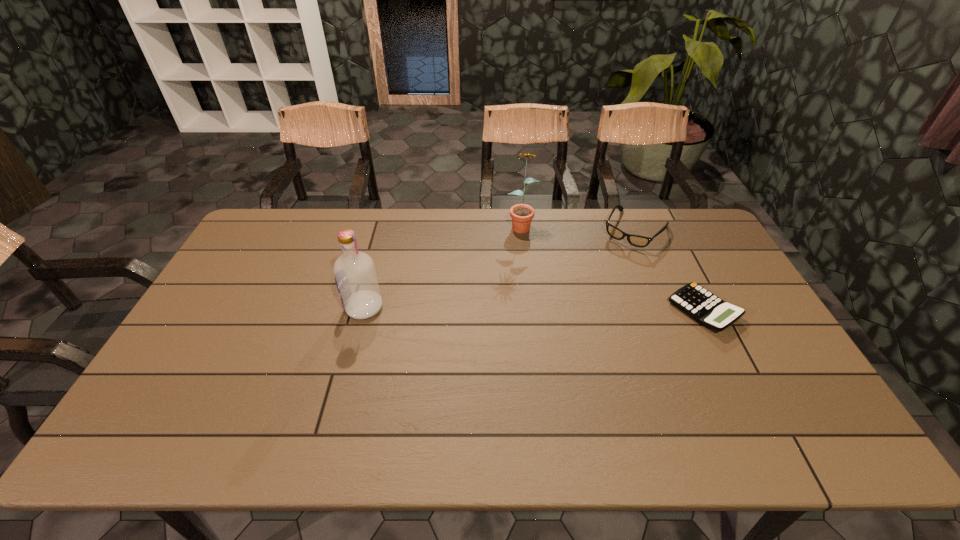
You are a GUI agent. You are given a task and a screenshot of the screen. Output one action in this format:
    pyautogui.click(x=<x>, y=<y>)
    Task: Click on the leftmost object
    This screenshot has height=540, width=960.
    Given the screenshot: What is the action you would take?
    pyautogui.click(x=355, y=275)

Find the location of `the shortest object`. the shortest object is located at coordinates (703, 306).

Where is `spectacles`? The height and width of the screenshot is (540, 960). spectacles is located at coordinates (635, 240).

What are the coordinates of `the third object from right to left` in the screenshot? It's located at (522, 214).

At what (x,y) coordinates should I click in order to perform the action: click on free space located on the label of the leftmost object. Please return your answer as a coordinate pair (x, y). Looking at the image, I should click on (244, 308).

The image size is (960, 540). What are the coordinates of `vacant space located on the label of the leftmost object` in the screenshot? It's located at (271, 308).

The height and width of the screenshot is (540, 960). I want to click on vacant space situated 0.340m on the label of the leftmost object, so click(x=230, y=308).

Where is `free space located on the front of the calculator`? free space located on the front of the calculator is located at coordinates (744, 391).

At what (x,y) coordinates should I click in order to perform the action: click on blank area located 0.310m on the front-facing side of the third tallest object. Please return your answer as a coordinate pair (x, y). Image resolution: width=960 pixels, height=540 pixels. Looking at the image, I should click on (584, 301).

Find the location of a particular element. This screenshot has height=540, width=960. free space located 0.160m on the front-facing side of the third tallest object is located at coordinates (604, 274).